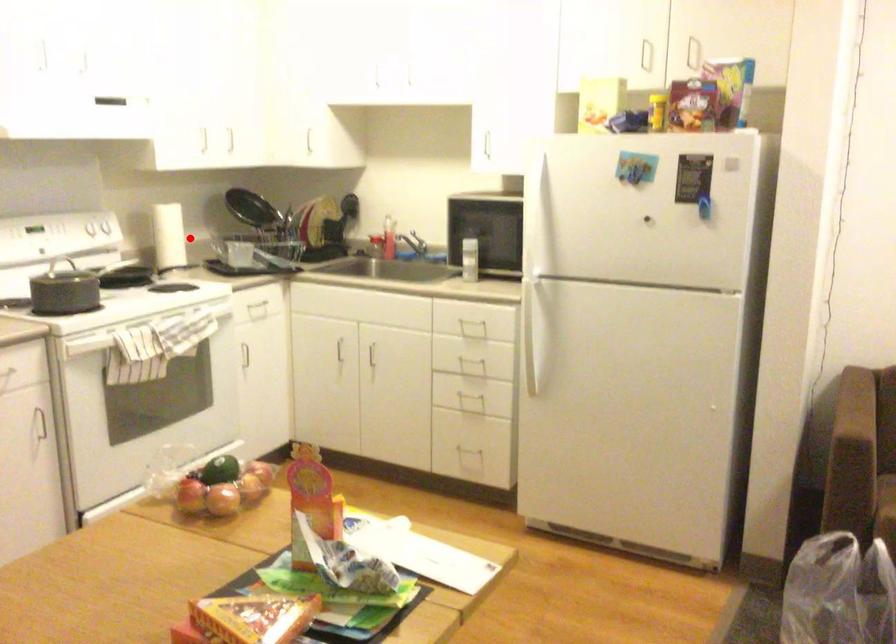
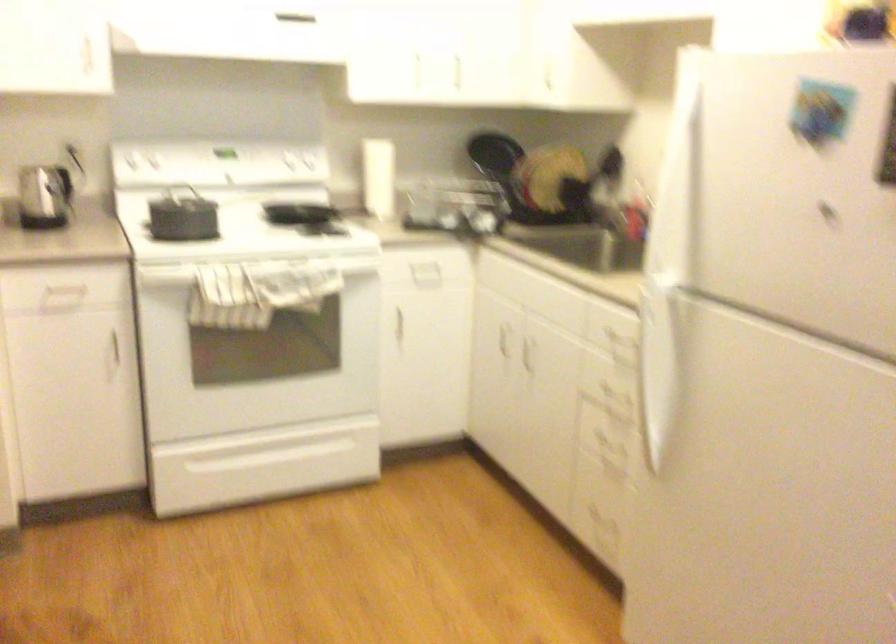
Question: I am providing you with two images of the same scene from different viewpoints. Image1 has a red point marked. In image2, the corresponding 3D location appears at what relative position? Reply with the corresponding letter.

Choices:
 (A) Closer
 (B) Farther

Answer: (A)